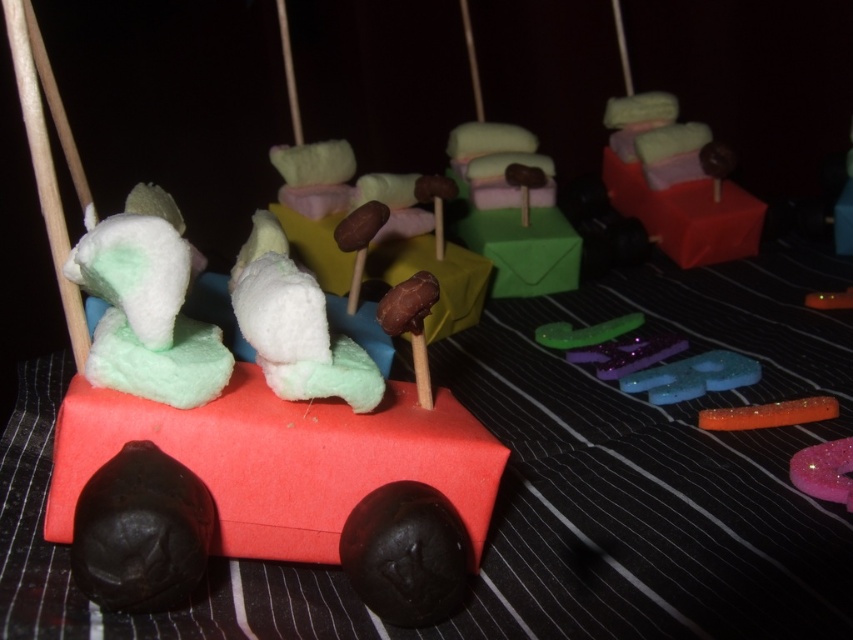
Question: Is matte pink candy at upper right wider than translucent blue glittery star at center?

Choices:
 (A) yes
 (B) no

Answer: (A)

Question: Which of the following is the farthest from the observer?

Choices:
 (A) glossy orange candy at center
 (B) white fluffy elephant at center
 (C) matte pink candy at upper right
 (D) white marshmallow at center

Answer: (C)

Question: Is the position of green felt envelope at center more distant than that of glittery pink letter at lower right?

Choices:
 (A) no
 (B) yes

Answer: (B)

Question: Which point is closer to the camera?

Choices:
 (A) glossy orange candy at center
 (B) translucent blue glittery star at center
 (C) white fluffy elephant at center

Answer: (C)

Question: Among these points, which one is nearest to the camera?

Choices:
 (A) tap(809, 484)
 (B) tap(498, 285)

Answer: (A)

Question: Observing the image, what is the correct spatial positioning of white fluffy elephant at center in reference to matte pink candy at upper right?

Choices:
 (A) below
 (B) above

Answer: (A)